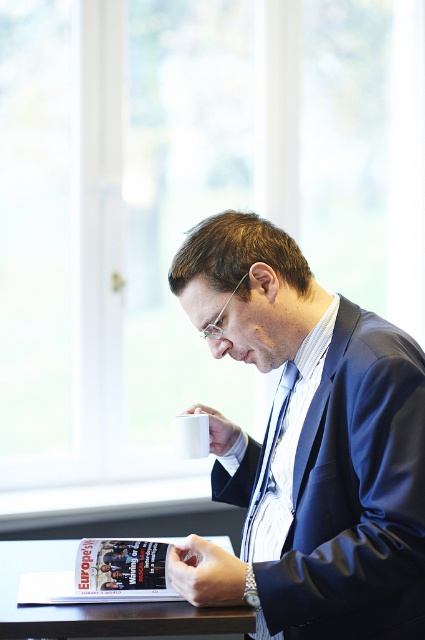
Who is positioned more to the left, blue glossy suit at center or matte paper magazine at lower center?

Positioned to the left is matte paper magazine at lower center.

Can you confirm if blue glossy suit at center is smaller than matte paper magazine at lower center?

No.

Who is more distant from viewer, (286, 291) or (34, 596)?

The point (286, 291) is more distant.

Where is `blue glossy suit at center`? blue glossy suit at center is located at coordinates (316, 435).

Which is more to the right, blue glossy suit at center or blue silk tie at center?

blue silk tie at center

From the picture: Is blue glossy suit at center positioned before blue silk tie at center?

Yes, blue glossy suit at center is in front of blue silk tie at center.

In the scene shown: Who is more distant from viewer, [252,301] or [260,502]?

Point [260,502]

Locate an element on the screen. The width and height of the screenshot is (425, 640). blue glossy suit at center is located at coordinates (316, 435).

Between matte paper magazine at lower center and blue silk tie at center, which one is positioned higher?

blue silk tie at center

Which is behind, point (161, 582) or point (255, 508)?

Point (255, 508)

Is point (121, 548) positioned in front of point (277, 417)?

Yes, it is in front of point (277, 417).

I want to click on matte paper magazine at lower center, so click(104, 573).